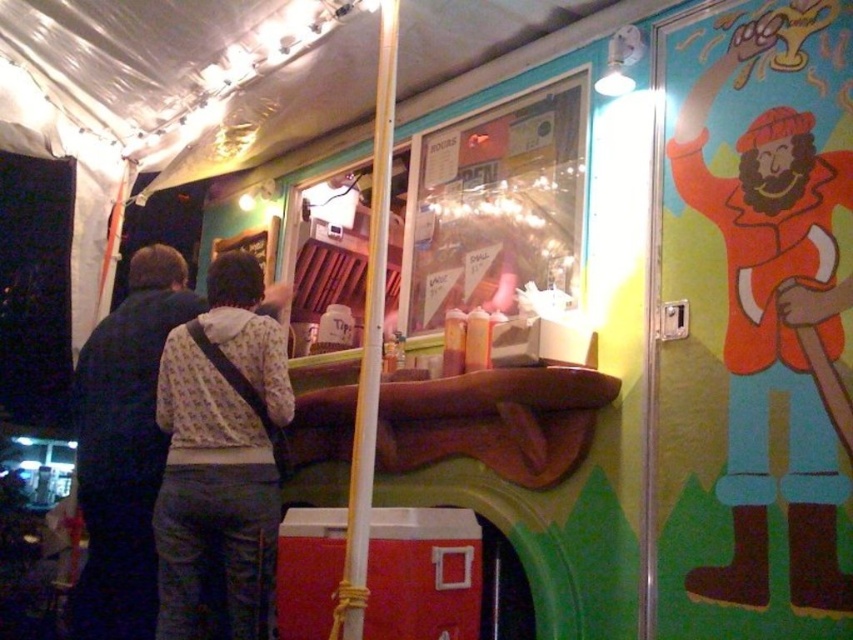
Question: Which of these objects is positioned farthest from the dark blue jacket at left?

Choices:
 (A) wooden pole at center
 (B) white printed shirt at center

Answer: (A)

Question: Is white printed shirt at center positioned at the back of wooden pole at center?

Choices:
 (A) no
 (B) yes

Answer: (B)

Question: Can you confirm if white printed shirt at center is positioned to the left of dark blue jacket at left?

Choices:
 (A) yes
 (B) no

Answer: (B)

Question: Is white printed shirt at center smaller than dark blue jacket at left?

Choices:
 (A) yes
 (B) no

Answer: (A)

Question: Among these points, which one is farthest from the camera?

Choices:
 (A) (381, 276)
 (B) (102, 429)

Answer: (B)

Question: Which object is the closest to the white printed shirt at center?

Choices:
 (A) dark blue jacket at left
 (B) wooden pole at center

Answer: (A)